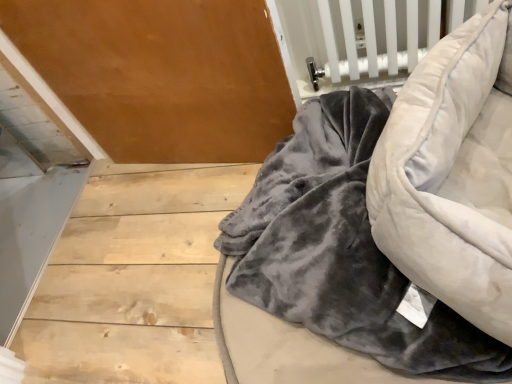
The image size is (512, 384). What do you see at coordinates (453, 173) in the screenshot?
I see `velvet gray bean bag chair at lower right` at bounding box center [453, 173].

Where is `velvet gray bean bag chair at lower right`? This screenshot has width=512, height=384. velvet gray bean bag chair at lower right is located at coordinates (453, 173).

What do you see at coordinates (382, 228) in the screenshot? I see `velvet gray blanket at lower right` at bounding box center [382, 228].

Identify the location of velvet gray blanket at lower right. Image resolution: width=512 pixels, height=384 pixels. (382, 228).

At what (x,y) coordinates should I click in order to perform the action: click on velvet gray bean bag chair at lower right. Please return your answer as a coordinate pair (x, y). The image size is (512, 384). Looking at the image, I should click on (453, 173).

Considering the relative positions of velvet gray bean bag chair at lower right and velvet gray blanket at lower right in the image provided, is velvet gray bean bag chair at lower right to the right of velvet gray blanket at lower right from the viewer's perspective?

Yes.

Between velvet gray bean bag chair at lower right and velvet gray blanket at lower right, which one is positioned behind?

velvet gray blanket at lower right is further from the camera.

Which is less distant, (x=448, y=95) or (x=342, y=300)?

The point (x=448, y=95) is in front.

From the image's perspective, would you say velvet gray bean bag chair at lower right is positioned over velvet gray blanket at lower right?

Yes, from the image's perspective, velvet gray bean bag chair at lower right is on top of velvet gray blanket at lower right.

From a real-world perspective, does velvet gray bean bag chair at lower right stand above velvet gray blanket at lower right?

Correct, in the physical world, velvet gray bean bag chair at lower right is higher than velvet gray blanket at lower right.

Considering the relative sizes of velvet gray bean bag chair at lower right and velvet gray blanket at lower right in the image provided, is velvet gray bean bag chair at lower right thinner than velvet gray blanket at lower right?

Indeed, velvet gray bean bag chair at lower right has a lesser width compared to velvet gray blanket at lower right.

Who is shorter, velvet gray bean bag chair at lower right or velvet gray blanket at lower right?

With less height is velvet gray blanket at lower right.

Looking at the image, does velvet gray bean bag chair at lower right seem bigger or smaller compared to velvet gray blanket at lower right?

In the image, velvet gray bean bag chair at lower right appears to be smaller than velvet gray blanket at lower right.

Is velvet gray blanket at lower right a part of velvet gray bean bag chair at lower right?

Actually, velvet gray blanket at lower right is outside velvet gray bean bag chair at lower right.

Is velvet gray bean bag chair at lower right with velvet gray blanket at lower right?

Yes.

Is velvet gray bean bag chair at lower right oriented away from velvet gray blanket at lower right?

velvet gray bean bag chair at lower right is not turned away from velvet gray blanket at lower right.

How much distance is there between velvet gray bean bag chair at lower right and velvet gray blanket at lower right?

velvet gray bean bag chair at lower right and velvet gray blanket at lower right are 2.92 inches apart from each other.

Find the location of a particular element. The height and width of the screenshot is (384, 512). bean bag chair on the right of velvet gray blanket at lower right is located at coordinates (453, 173).

Can you confirm if velvet gray blanket at lower right is positioned to the right of velvet gray bean bag chair at lower right?

In fact, velvet gray blanket at lower right is to the left of velvet gray bean bag chair at lower right.

Is velvet gray blanket at lower right closer to camera compared to velvet gray bean bag chair at lower right?

No, it is not.

Considering the positions of points (507, 7) and (479, 184), is point (507, 7) farther from camera compared to point (479, 184)?

Yes.

From the image's perspective, which one is positioned higher, velvet gray blanket at lower right or velvet gray bean bag chair at lower right?

velvet gray bean bag chair at lower right appears higher in the image.

From a real-world perspective, is velvet gray blanket at lower right above or below velvet gray bean bag chair at lower right?

velvet gray blanket at lower right is below velvet gray bean bag chair at lower right.

Is velvet gray blanket at lower right wider or thinner than velvet gray bean bag chair at lower right?

Considering their sizes, velvet gray blanket at lower right looks broader than velvet gray bean bag chair at lower right.

Between velvet gray blanket at lower right and velvet gray bean bag chair at lower right, which one has less height?

Standing shorter between the two is velvet gray blanket at lower right.

Is velvet gray blanket at lower right smaller than velvet gray bean bag chair at lower right?

No.

Is velvet gray bean bag chair at lower right inside velvet gray blanket at lower right?

Actually, velvet gray bean bag chair at lower right is outside velvet gray blanket at lower right.

Is velvet gray blanket at lower right far from velvet gray bean bag chair at lower right?

velvet gray blanket at lower right is actually quite close to velvet gray bean bag chair at lower right.

Is velvet gray blanket at lower right facing away from velvet gray bean bag chair at lower right?

velvet gray blanket at lower right does not have its back to velvet gray bean bag chair at lower right.

How different are the orientations of velvet gray blanket at lower right and velvet gray bean bag chair at lower right in degrees?

velvet gray blanket at lower right and velvet gray bean bag chair at lower right are facing 66.3 degrees away from each other.

Measure the distance from velvet gray blanket at lower right to velvet gray bean bag chair at lower right.

velvet gray blanket at lower right and velvet gray bean bag chair at lower right are 2.92 inches apart.

Locate an element on the screen. This screenshot has height=384, width=512. furniture located on the left of velvet gray bean bag chair at lower right is located at coordinates (382, 228).

The height and width of the screenshot is (384, 512). I want to click on furniture behind the velvet gray bean bag chair at lower right, so coord(382,228).

This screenshot has width=512, height=384. What are the coordinates of `bean bag chair that appears above the velvet gray blanket at lower right (from a real-world perspective)` in the screenshot? It's located at (453, 173).